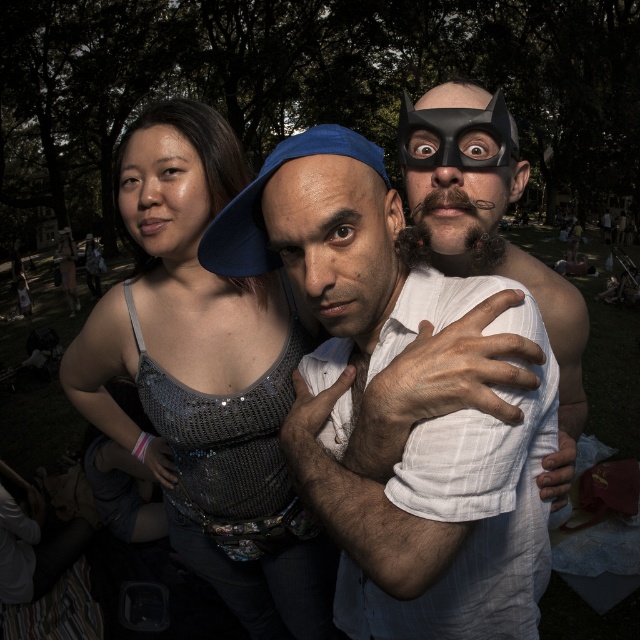
You are standing in a festival crowd and see the white textured shirt at center. Can you estimate its position relative to the camera using coordinates?

The white textured shirt at center is located at coordinates approximately 0.672 on the x axis and 0.645 on the y axis.

You are a photographer trying to capture the central figures in this festival scene. You notice the white textured shirt at center and the shiny sequined tank top at center. Which of these two items has a smaller width?

The white textured shirt at center has a smaller width compared to the shiny sequined tank top at center.